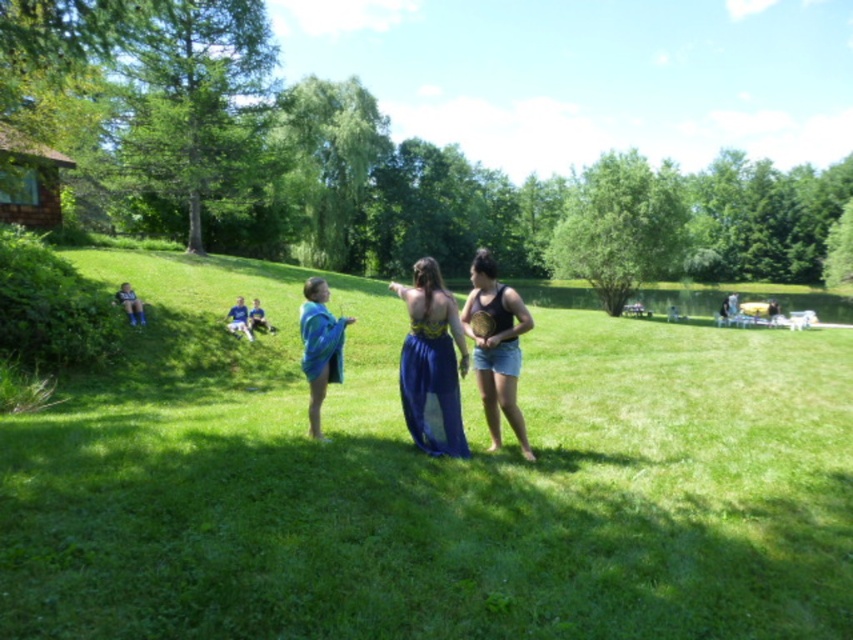
You are a photographer planning to take a photo of the two people in the scene. You want to ensure that both the blue satin dress at center and the blue denim shorts at lower left are clearly visible in the frame. Based on their positions, which person should you focus on first to ensure both are in focus?

The blue satin dress at center is taller than the blue denim shorts at lower left, so you should focus on the person wearing the blue satin dress at center first to ensure both are in focus.

You are a photographer planning to take a portrait of the two people in the scene. Given that the black matte tank top at center and the blue denim shorts at lower left are both in the frame, which clothing item will appear larger in the photo?

The black matte tank top at center will appear larger in the photo because it is much taller than the blue denim shorts at lower left.